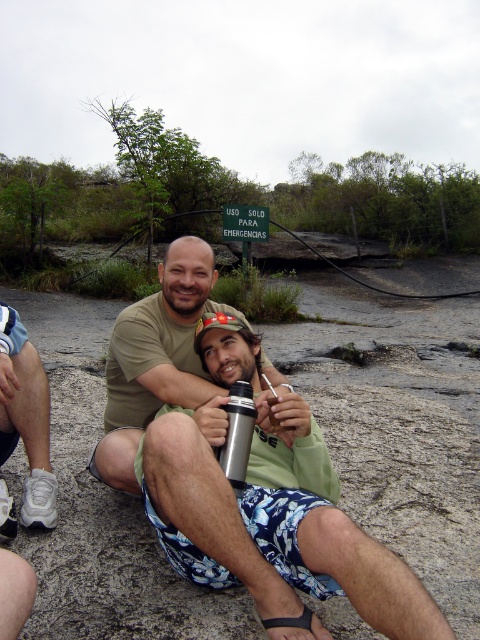
You are a photographer trying to capture both the metallic silver thermos at center and the silver metallic thermos at center in a single shot. Which thermos will appear larger in the photo?

Result: The metallic silver thermos at center will appear larger in the photo because it is closer to the viewer than the silver metallic thermos at center.